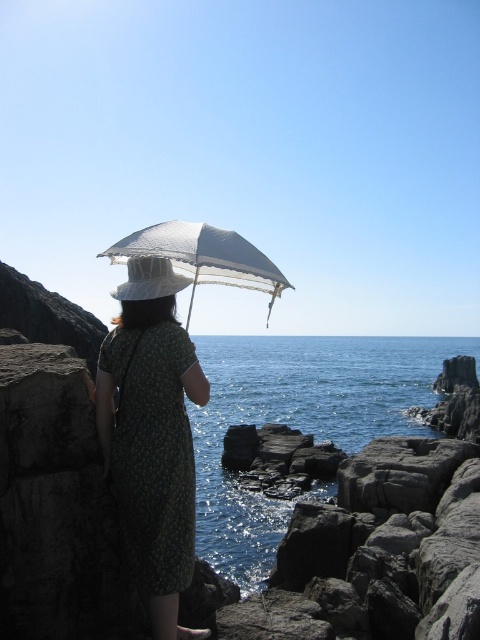
Question: Which point is closer to the camera?

Choices:
 (A) (168, 253)
 (B) (157, 298)
 (C) (118, 460)

Answer: (C)

Question: Is green floral dress at left below white woven hat at center?

Choices:
 (A) yes
 (B) no

Answer: (A)

Question: Can you confirm if green floral dress at left is bigger than white lace umbrella at center?

Choices:
 (A) no
 (B) yes

Answer: (A)

Question: Is green floral dress at left further to the viewer compared to white lace umbrella at center?

Choices:
 (A) no
 (B) yes

Answer: (B)

Question: Which of the following is the closest to the observer?

Choices:
 (A) white lace umbrella at center
 (B) white woven hat at center

Answer: (A)

Question: Which of the following is the closest to the observer?

Choices:
 (A) (267, 317)
 (B) (124, 449)
 (C) (143, 296)

Answer: (B)